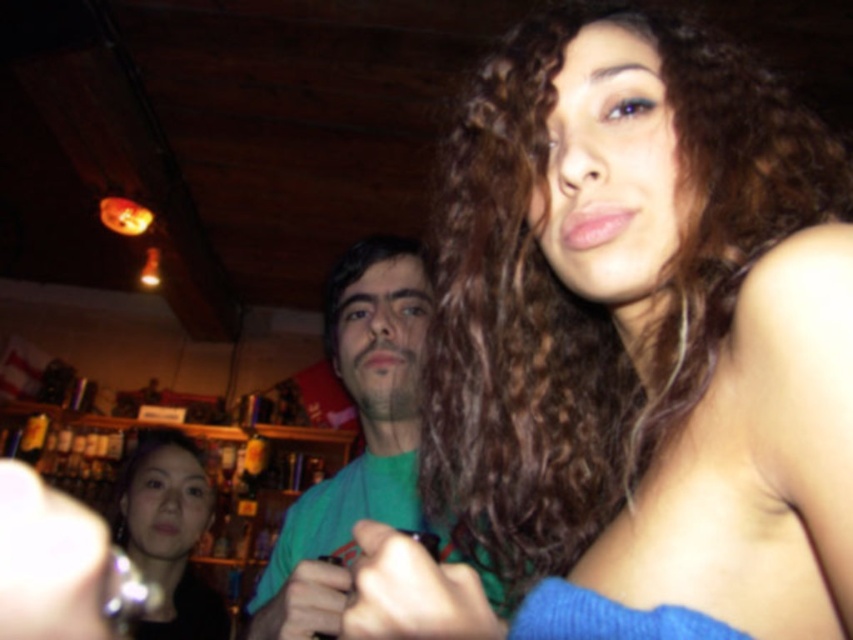
Looking at this image, you are a photographer trying to capture a candid shot of the scene. You notice the matte black phone at lower left and the matte green hand at center. Which object is located to the left of the other?

The matte black phone at lower left is positioned on the left side of the matte green hand at center.

You are standing in the bar and want to place a small plant between the two points labeled point (45, 561) and point (323, 625). Which point should the plant be closer to in order to be nearer to the viewer?

The plant should be closer to point (45, 561) because it is nearer to the viewer compared to point (323, 625).